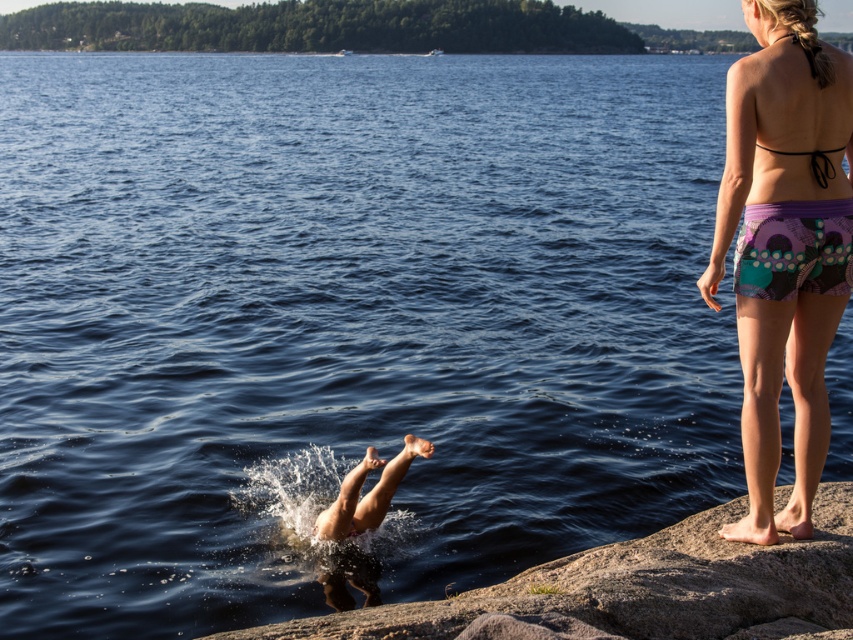
Which is behind, point (822, 305) or point (384, 465)?

The point (384, 465) is behind.

Does purple printed shorts at right have a lesser height compared to smooth skin person at center?

No, purple printed shorts at right is not shorter than smooth skin person at center.

This screenshot has width=853, height=640. I want to click on purple printed shorts at right, so click(x=784, y=248).

Locate an element on the screen. The image size is (853, 640). purple printed shorts at right is located at coordinates (784, 248).

Between gray granite rock at lower center and smooth skin person at center, which one appears on the left side from the viewer's perspective?

From the viewer's perspective, smooth skin person at center appears more on the left side.

Can you confirm if gray granite rock at lower center is wider than smooth skin person at center?

Yes.

Is point (730, 589) closer to camera compared to point (340, 566)?

Yes, point (730, 589) is closer to viewer.

The width and height of the screenshot is (853, 640). I want to click on gray granite rock at lower center, so click(637, 589).

The height and width of the screenshot is (640, 853). In order to click on purple printed shorts at right in this screenshot , I will do `click(784, 248)`.

Is purple printed shorts at right to the right of gray granite rock at lower center from the viewer's perspective?

Correct, you'll find purple printed shorts at right to the right of gray granite rock at lower center.

Between point (834, 324) and point (816, 573), which one is positioned behind?

Positioned behind is point (834, 324).

Where is `purple printed shorts at right`? This screenshot has height=640, width=853. purple printed shorts at right is located at coordinates (784, 248).